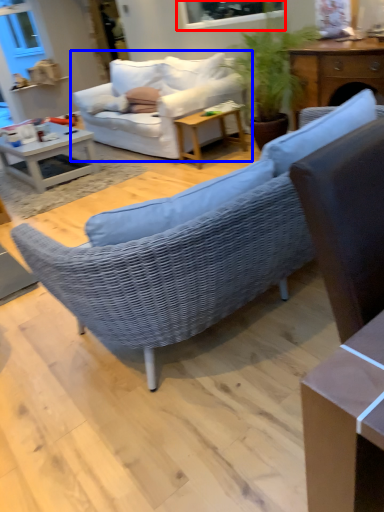
Question: Among these objects, which one is nearest to the camera, window screen (highlighted by a red box) or studio couch (highlighted by a blue box)?

Choices:
 (A) window screen
 (B) studio couch

Answer: (A)